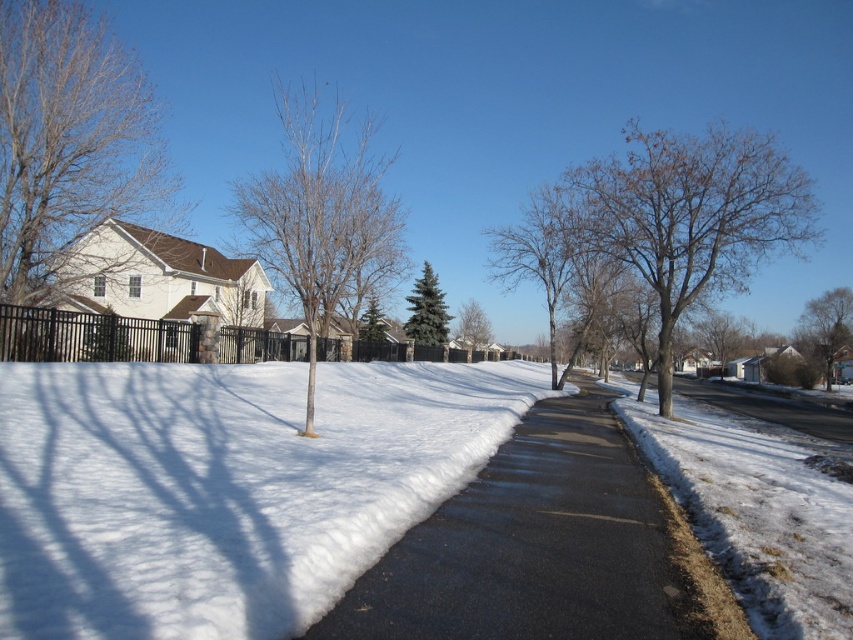
You are a photographer planning to capture both the bare branches at center and the green textured evergreen tree at center in a single frame. Given their sizes, which one will occupy more space in your photo?

The bare branches at center is bigger than the green textured evergreen tree at center, so it will occupy more space in the photo.

You are standing at the center of the image and want to place a small snowman exactly where the white fluffy snow at center is located. What are the coordinates of the spot where you should build the snowman?

The coordinates for the white fluffy snow at center are at point (225, 486), so you should build the snowman there.